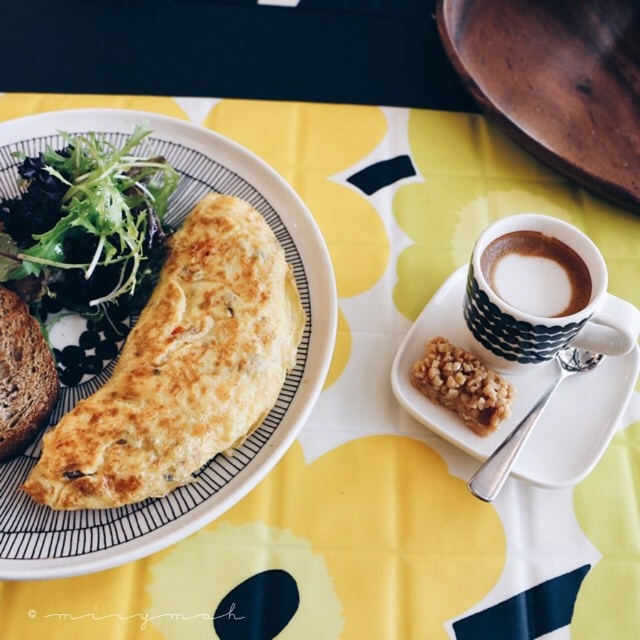
Who is positioned more to the left, wooden spoon at upper right or brown rustic bread at left?

brown rustic bread at left

Is wooden spoon at upper right below brown rustic bread at left?

Incorrect, wooden spoon at upper right is not positioned below brown rustic bread at left.

Is point (460, 20) farther from viewer compared to point (1, 426)?

Yes, it is.

This screenshot has width=640, height=640. I want to click on wooden spoon at upper right, so click(556, 81).

Can you confirm if green leafymaterial/texturesalad at left is positioned below white ceramic plate at upper right?

Incorrect, green leafymaterial/texturesalad at left is not positioned below white ceramic plate at upper right.

Is point (154, 278) positioned in front of point (458, 312)?

Yes, it is in front of point (458, 312).

At what (x,y) coordinates should I click in order to perform the action: click on green leafymaterial/texturesalad at left. Please return your answer as a coordinate pair (x, y). The height and width of the screenshot is (640, 640). Looking at the image, I should click on (84, 240).

The width and height of the screenshot is (640, 640). I want to click on green leafymaterial/texturesalad at left, so click(84, 240).

Does golden-brown omelette at left have a larger size compared to cappuccino foam cup at right?

Indeed, golden-brown omelette at left has a larger size compared to cappuccino foam cup at right.

Between point (10, 577) and point (552, 298), which one is positioned behind?

Point (552, 298)

Between point (42, 525) and point (522, 280), which one is positioned behind?

Point (522, 280)

Image resolution: width=640 pixels, height=640 pixels. What are the coordinates of `golden-brown omelette at left` in the screenshot? It's located at (260, 424).